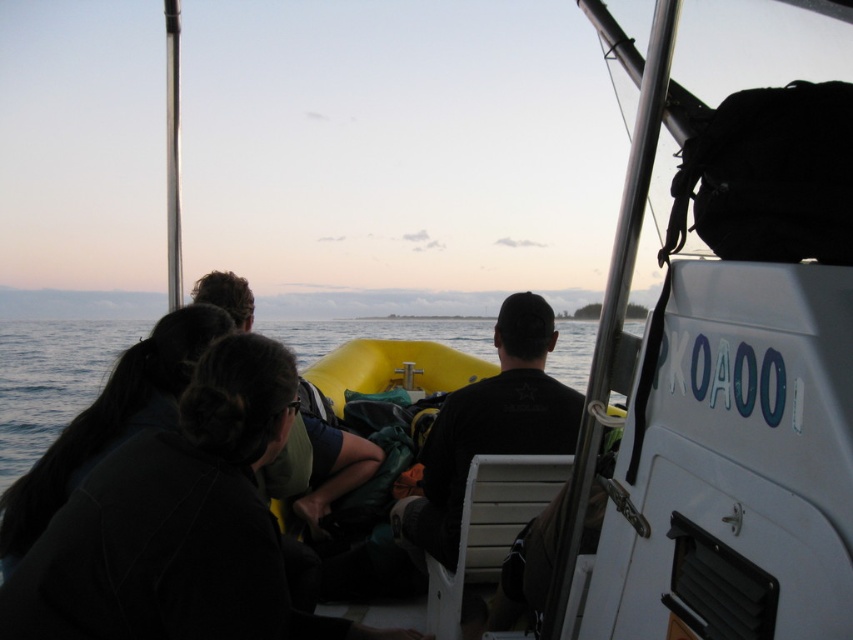
Question: Which of the following is the farthest from the observer?

Choices:
 (A) black matte shirt at center
 (B) blue water at lower left
 (C) dark green fabric at center

Answer: (C)

Question: Which is farther from the black matte shirt at center?

Choices:
 (A) blue water at lower left
 (B) dark green fabric at center

Answer: (A)

Question: Is blue water at lower left thinner than black matte shirt at center?

Choices:
 (A) no
 (B) yes

Answer: (A)

Question: Which of the following is the closest to the observer?

Choices:
 (A) (x=0, y=326)
 (B) (x=437, y=413)
 (C) (x=323, y=435)

Answer: (C)

Question: Is blue water at lower left above dark green fabric at center?

Choices:
 (A) yes
 (B) no

Answer: (A)

Question: Can you confirm if black matte shirt at center is bigger than dark green fabric at center?

Choices:
 (A) yes
 (B) no

Answer: (A)